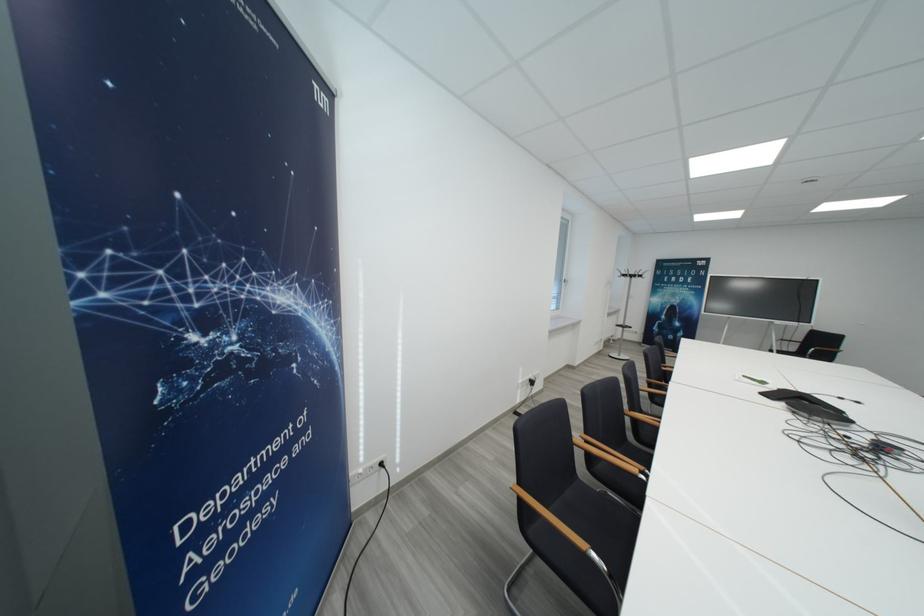
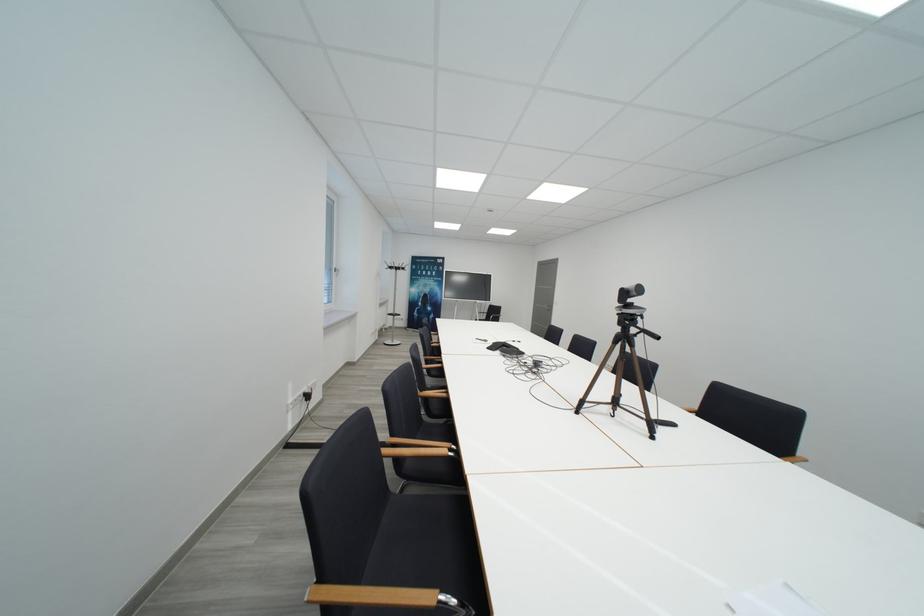
Question: The camera is either moving clockwise (left) or counter-clockwise (right) around the object. The first image is from the beginning of the video and the second image is from the end. Is the camera moving left or right when shooting the video?

Choices:
 (A) Left
 (B) Right

Answer: (A)